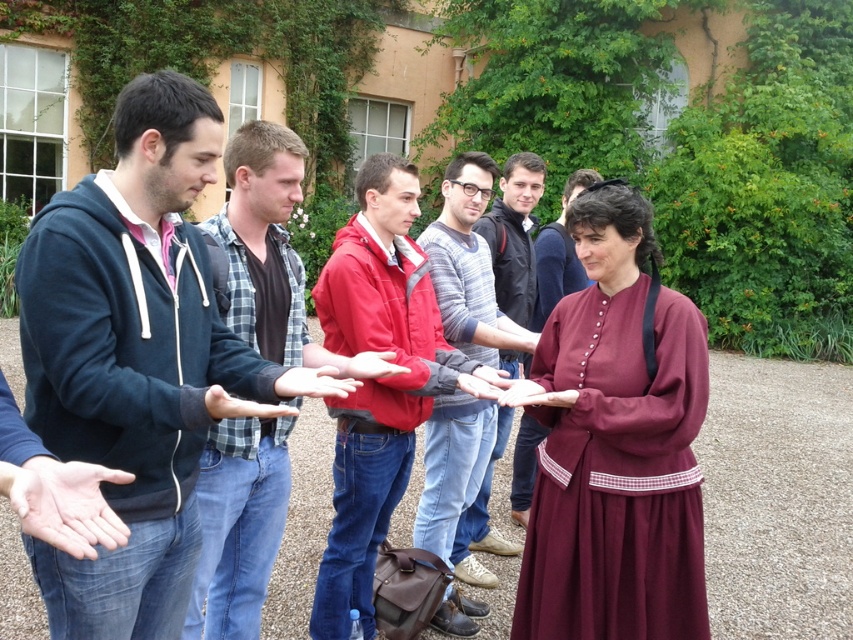
You are standing in the courtyard and want to find the matte red hoodie at center. Based on the coordinates provided, where should you look relative to the group of people?

The matte red hoodie at center is located at coordinates point (469, 268), which is at the center of the image. Since the group of people are arranged in a semi circle, the matte red hoodie at center is likely positioned in the middle area where the semi circle faces.

You are a photographer positioned at the edge of the gravel courtyard. You want to capture a candid shot of the group while ensuring both the red jacket at center and the smooth skin hand at center are in focus. Given that your camera has a depth of field that can sharply focus objects within a 90 cm range, will both subjects be in focus?

The distance between the red jacket at center and the smooth skin hand at center is 88.51 centimeters, which is within the camera lens depth of field range of 90 cm. Therefore, both subjects will be in focus.